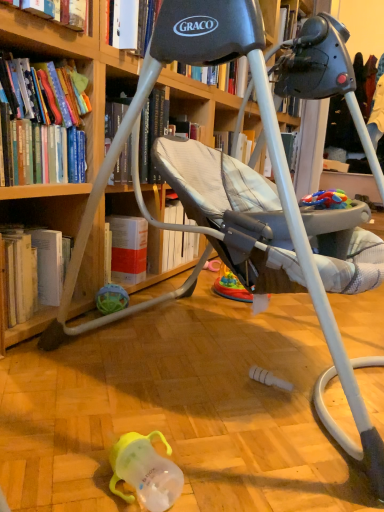
Question: Is hardcover book at upper left, which appears as the first book when viewed from the top, with wooden bookcase at upper left?

Choices:
 (A) yes
 (B) no

Answer: (B)

Question: Considering the relative sizes of hardcover book at upper left, acting as the third book starting from the bottom, and wooden bookcase at upper left in the image provided, is hardcover book at upper left, acting as the third book starting from the bottom, wider than wooden bookcase at upper left?

Choices:
 (A) no
 (B) yes

Answer: (A)

Question: Considering the relative sizes of hardcover book at upper left, acting as the third book starting from the bottom, and wooden bookcase at upper left in the image provided, is hardcover book at upper left, acting as the third book starting from the bottom, shorter than wooden bookcase at upper left?

Choices:
 (A) yes
 (B) no

Answer: (A)

Question: Considering the relative positions of hardcover book at upper left, acting as the third book starting from the bottom, and wooden bookcase at upper left in the image provided, is hardcover book at upper left, acting as the third book starting from the bottom, behind wooden bookcase at upper left?

Choices:
 (A) yes
 (B) no

Answer: (A)

Question: From a real-world perspective, is hardcover book at upper left, which appears as the first book when viewed from the top, under wooden bookcase at upper left?

Choices:
 (A) yes
 (B) no

Answer: (B)

Question: From a real-world perspective, does hardcover book at upper left, which appears as the first book when viewed from the top, stand above wooden bookcase at upper left?

Choices:
 (A) no
 (B) yes

Answer: (B)

Question: Considering the relative sizes of hardcover book at lower left, the first book when ordered from bottom to top, and translucent rubber ball at lower left, the first toy in the back-to-front sequence, in the image provided, is hardcover book at lower left, the first book when ordered from bottom to top, wider than translucent rubber ball at lower left, the first toy in the back-to-front sequence,?

Choices:
 (A) no
 (B) yes

Answer: (B)

Question: From a real-world perspective, is hardcover book at lower left, which is the 3th book from top to bottom, located higher than translucent rubber ball at lower left, which is the 2th toy in right-to-left order?

Choices:
 (A) yes
 (B) no

Answer: (A)

Question: Is hardcover book at lower left, which is the 3th book from top to bottom, further to camera compared to translucent rubber ball at lower left, which is the 2th toy in right-to-left order?

Choices:
 (A) yes
 (B) no

Answer: (B)

Question: Are hardcover book at lower left, the first book when ordered from bottom to top, and translucent rubber ball at lower left, the first toy in the back-to-front sequence, located far from each other?

Choices:
 (A) yes
 (B) no

Answer: (B)

Question: Considering the relative positions of hardcover book at lower left, which is the 3th book from top to bottom, and translucent rubber ball at lower left, the first toy in the back-to-front sequence, in the image provided, is hardcover book at lower left, which is the 3th book from top to bottom, in front of translucent rubber ball at lower left, the first toy in the back-to-front sequence,?

Choices:
 (A) yes
 (B) no

Answer: (A)

Question: Is hardcover book at lower left, the first book when ordered from bottom to top, directly adjacent to translucent rubber ball at lower left, which is the second toy from front to back?

Choices:
 (A) yes
 (B) no

Answer: (B)

Question: Does rubberized plastic toy at right, which is the 2th toy in bottom-to-top order, have a greater width compared to hardcover book at lower left, the first book when ordered from bottom to top?

Choices:
 (A) yes
 (B) no

Answer: (B)